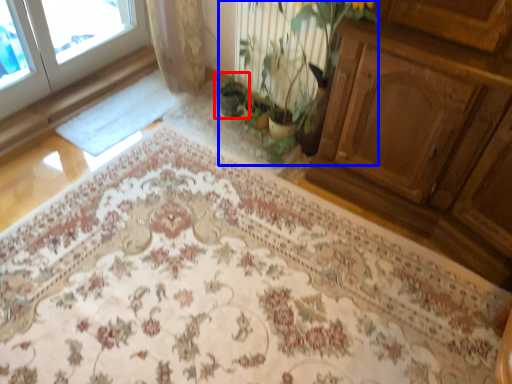
Question: Which point is further to the camera, houseplant (highlighted by a red box) or floral arrangement (highlighted by a blue box)?

Choices:
 (A) houseplant
 (B) floral arrangement

Answer: (A)